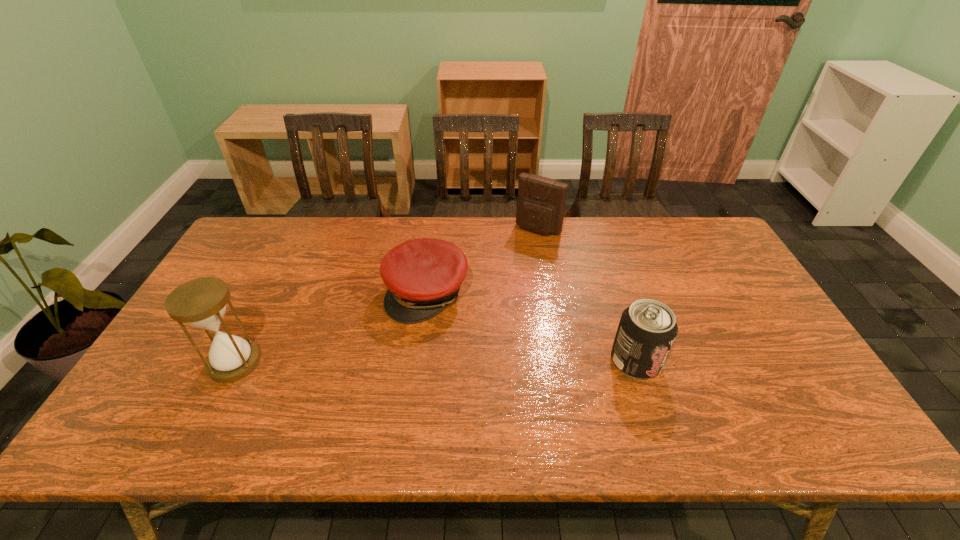
The width and height of the screenshot is (960, 540). In order to click on vacant space on the desktop that is between the hourglass and the rightmost object and is positioned with an open flap on the farthest object in this screenshot , I will do `click(445, 362)`.

Locate an element on the screen. vacant space on the desktop that is between the hourglass and the second shortest object and is positioned on the front of the third object from right to left with an emblem is located at coordinates (389, 362).